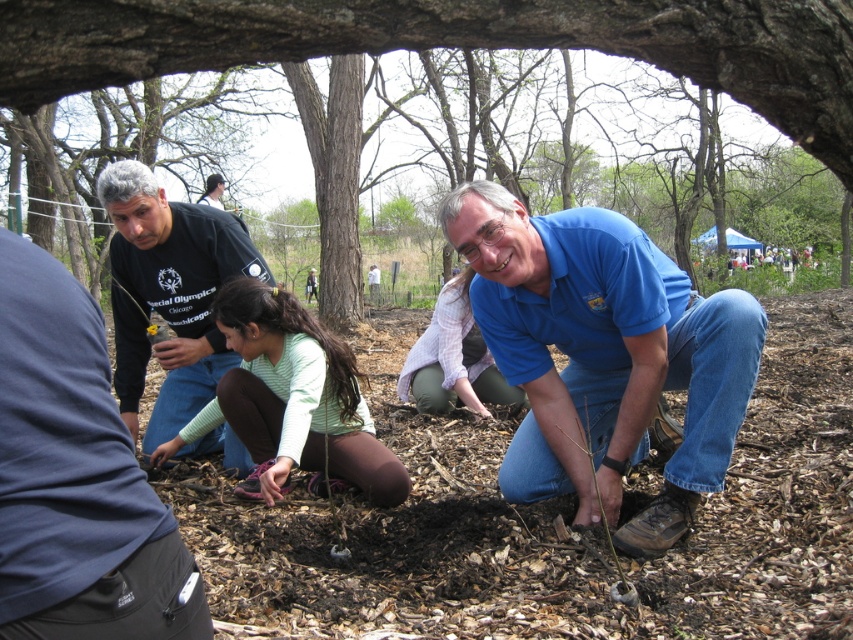
Question: Is brown mulch at center positioned in front of light purple shirt at center?

Choices:
 (A) yes
 (B) no

Answer: (A)

Question: Which of these objects is positioned closest to the green matte shirt at center?

Choices:
 (A) brown mulch at center
 (B) light purple shirt at center
 (C) blue cotton shirt at center
 (D) dark blue shirt at left

Answer: (D)

Question: Is blue cotton shirt at center to the left of brown mulch at center from the viewer's perspective?

Choices:
 (A) yes
 (B) no

Answer: (B)

Question: Is brown mulch at center bigger than green matte shirt at center?

Choices:
 (A) no
 (B) yes

Answer: (A)

Question: Which of the following is the farthest from the observer?

Choices:
 (A) blue cotton shirt at center
 (B) green matte shirt at center

Answer: (B)

Question: Which of the following is the farthest from the observer?

Choices:
 (A) (582, 38)
 (B) (585, 237)

Answer: (B)